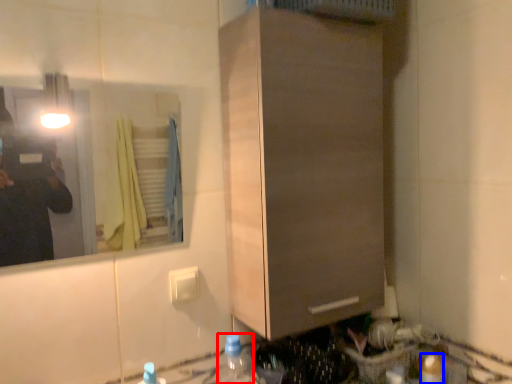
Question: Among these objects, which one is farthest to the camera, bottle (highlighted by a red box) or bottle (highlighted by a blue box)?

Choices:
 (A) bottle
 (B) bottle

Answer: (B)